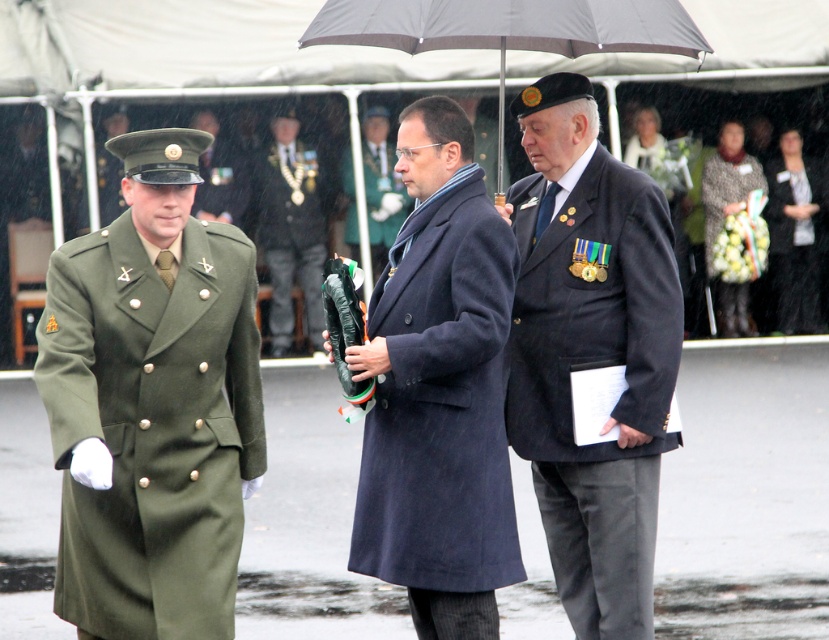
Question: Is the position of green woolen coat at left less distant than that of black fabric coat at right?

Choices:
 (A) no
 (B) yes

Answer: (B)

Question: Does shiny black suit at center appear on the right side of green matte uniform at left?

Choices:
 (A) yes
 (B) no

Answer: (A)

Question: Which is nearer to the matte green coat at center?

Choices:
 (A) green woolen coat at left
 (B) gray matte umbrella at center
 (C) shiny black suit at center
 (D) dark blue textured suit at center

Answer: (C)

Question: Which point is farther from the camera taking this photo?

Choices:
 (A) (529, 307)
 (B) (287, 280)
 (C) (199, 637)

Answer: (B)

Question: Is shiny black suit at center smaller than matte green coat at center?

Choices:
 (A) yes
 (B) no

Answer: (B)

Question: Which object is the farthest from the green matte uniform at left?

Choices:
 (A) gray matte umbrella at center
 (B) shiny black suit at center

Answer: (A)